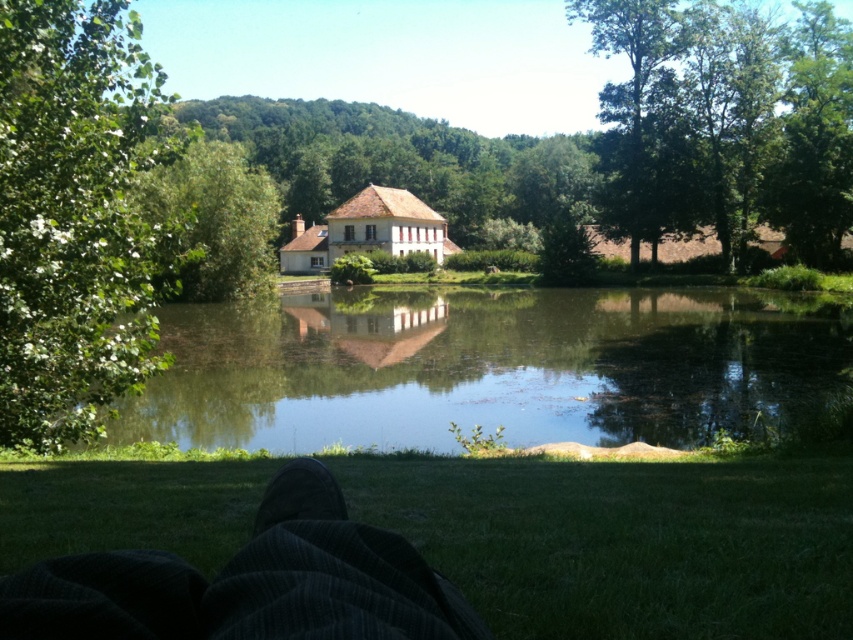
Does green leafy tree at upper right have a greater width compared to green leafy tree at center?

Correct, the width of green leafy tree at upper right exceeds that of green leafy tree at center.

From the picture: Can you confirm if green leafy tree at upper right is positioned above green leafy tree at center?

Yes.

Between point (776, 160) and point (252, 208), which one is positioned in front?

Point (252, 208)

Identify the location of green leafy tree at upper right. Image resolution: width=853 pixels, height=640 pixels. (724, 122).

Between clear water at center and dark corduroy pants at lower center, which one is positioned lower?

dark corduroy pants at lower center is lower down.

Does point (286, 362) lie behind point (274, 632)?

That is True.

Does point (759, 396) lie behind point (433, 584)?

Yes, it is.

Identify the location of clear water at center. The image size is (853, 640). (488, 368).

Who is more forward, (717, 120) or (299, 513)?

Point (299, 513)

Is green leafy tree at upper right to the right of black fabric foot at lower center from the viewer's perspective?

Correct, you'll find green leafy tree at upper right to the right of black fabric foot at lower center.

Does point (842, 60) come farther from viewer compared to point (312, 496)?

Yes, it is behind point (312, 496).

Where is `green leafy tree at upper right`? Image resolution: width=853 pixels, height=640 pixels. green leafy tree at upper right is located at coordinates (724, 122).